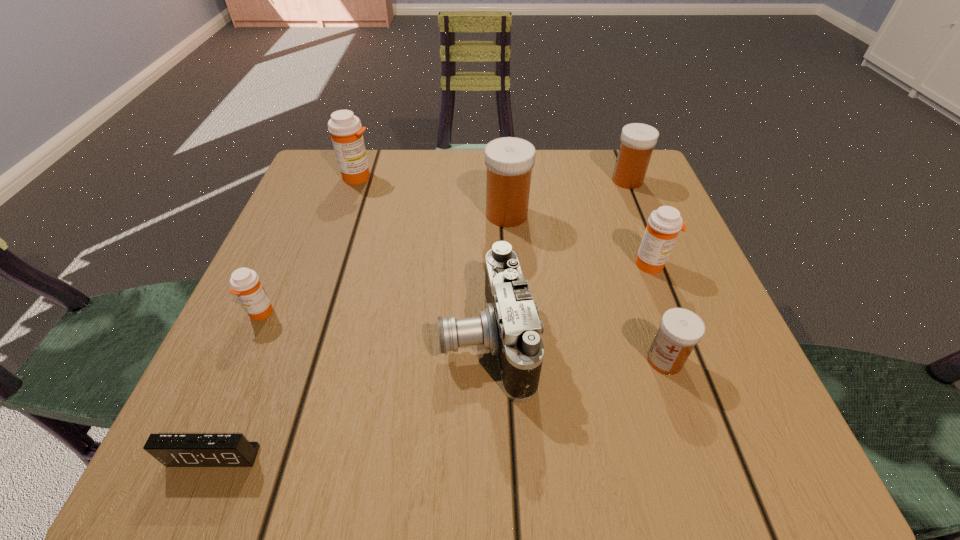
In the image, there is a desktop. Where is `free region at the left edge`? The image size is (960, 540). free region at the left edge is located at coordinates (293, 216).

Find the location of a particular element. The width and height of the screenshot is (960, 540). vacant space at the right edge of the desktop is located at coordinates (728, 375).

Identify the location of vacant space at the far left corner of the desktop. The height and width of the screenshot is (540, 960). (324, 176).

Find the location of `free spot at the near left corner of the desktop`. free spot at the near left corner of the desktop is located at coordinates (254, 415).

This screenshot has height=540, width=960. What are the coordinates of `free space between the camera and the farthest white medicine` in the screenshot? It's located at (557, 259).

In order to click on free space between the leftmost orange medicine and the second smallest white medicine in this screenshot , I will do `click(444, 247)`.

At what (x,y) coordinates should I click in order to perform the action: click on vacant point located between the biggest orange medicine and the alarm clock. Please return your answer as a coordinate pair (x, y). This screenshot has width=960, height=540. Looking at the image, I should click on (286, 316).

I want to click on vacant area between the fourth farthest medicine and the smallest white medicine, so click(x=659, y=312).

Find the location of a particular element. Image resolution: width=960 pixels, height=540 pixels. free point between the biggest orange medicine and the shortest object is located at coordinates (286, 316).

Where is `unoccupied area between the farthest orange medicine and the leftmost medicine`? The image size is (960, 540). unoccupied area between the farthest orange medicine and the leftmost medicine is located at coordinates (309, 245).